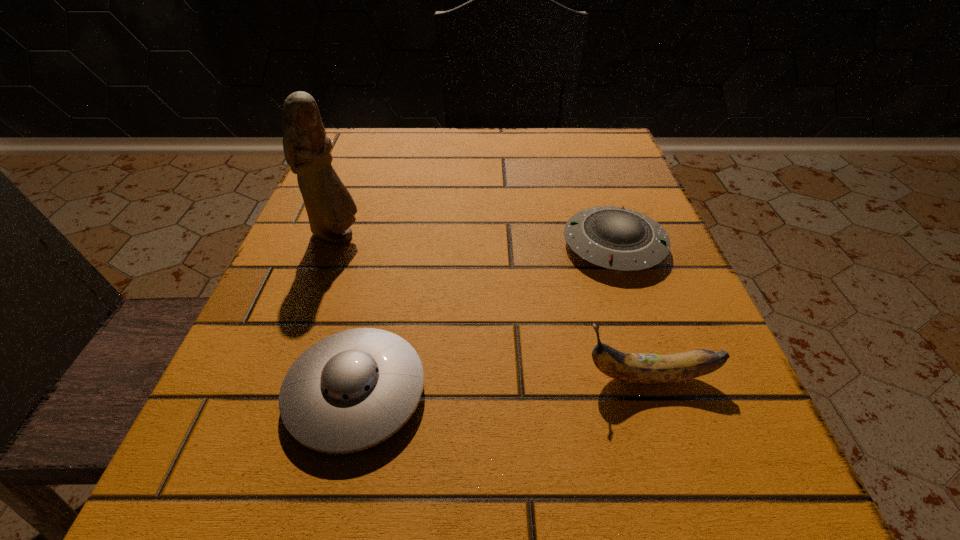
Image resolution: width=960 pixels, height=540 pixels. I want to click on free region at the far left corner of the desktop, so click(361, 162).

Where is `vacant region at the far right corner of the desktop`? vacant region at the far right corner of the desktop is located at coordinates (596, 164).

Where is `vacant region between the tallest object and the taller saucer`? vacant region between the tallest object and the taller saucer is located at coordinates (347, 314).

Where is `unoccupied position between the figurine and the taller saucer`? This screenshot has width=960, height=540. unoccupied position between the figurine and the taller saucer is located at coordinates point(347,314).

This screenshot has height=540, width=960. Identify the location of free spot between the second tallest object and the farther saucer. (632, 311).

I want to click on free space between the third shortest object and the figurine, so click(x=492, y=307).

Locate an element on the screen. The image size is (960, 540). unoccupied area between the banana and the farther saucer is located at coordinates (632, 311).

This screenshot has height=540, width=960. In order to click on vacant area that lies between the third shortest object and the nearer saucer in this screenshot , I will do `click(502, 385)`.

Find the location of `blank region between the farther saucer and the taller saucer`. blank region between the farther saucer and the taller saucer is located at coordinates (485, 319).

This screenshot has height=540, width=960. What are the coordinates of `unoccupied area between the left saucer and the banana` in the screenshot? It's located at coord(502,385).